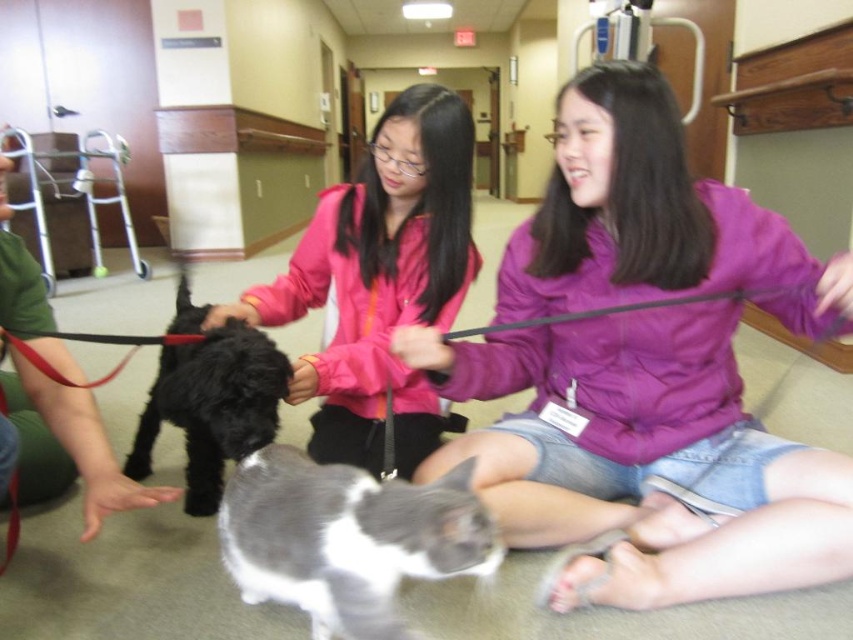
You are a visitor in this hospital setting and need to locate the black matte dog at center. According to the coordinates provided, where exactly is the black matte dog positioned in the image?

The black matte dog at center is located at point coordinates of 0.636 on the x axis and 0.250 on the y axis.

You are standing at the entrance of the hospital room and see the point marked at coordinates (379, 280). What object is located at that point?

The point at coordinates (379, 280) corresponds to the matte pink jacket at center.

You are a visitor in this hospital scene. You need to locate the person wearing the matte pink jacket at center. Can you tell me their exact coordinates in the room?

The matte pink jacket at center is located at coordinates point (379, 280).